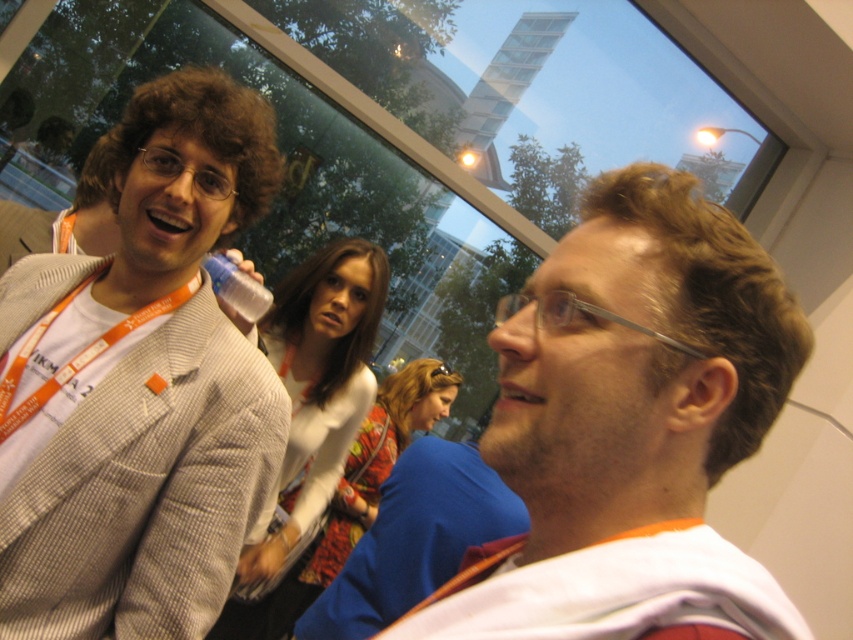
Question: Can you confirm if white sweater at center is positioned above clear plastic bottle at upper center?

Choices:
 (A) no
 (B) yes

Answer: (A)

Question: Which of these objects is positioned closest to the clear plastic bottle at upper center?

Choices:
 (A) white sweater at center
 (B) gray checkered blazer at left
 (C) floral fabric dress at center

Answer: (B)

Question: Which point is closer to the camera taking this photo?

Choices:
 (A) (277, 566)
 (B) (370, 445)

Answer: (A)

Question: Can you confirm if smooth orange hoodie at right is positioned to the left of clear plastic bottle at upper center?

Choices:
 (A) no
 (B) yes

Answer: (A)

Question: Is gray checkered blazer at left to the left of clear plastic bottle at upper center from the viewer's perspective?

Choices:
 (A) yes
 (B) no

Answer: (A)

Question: Which of the following is the farthest from the observer?

Choices:
 (A) white sweater at center
 (B) clear plastic bottle at upper center
 (C) smooth orange hoodie at right

Answer: (A)